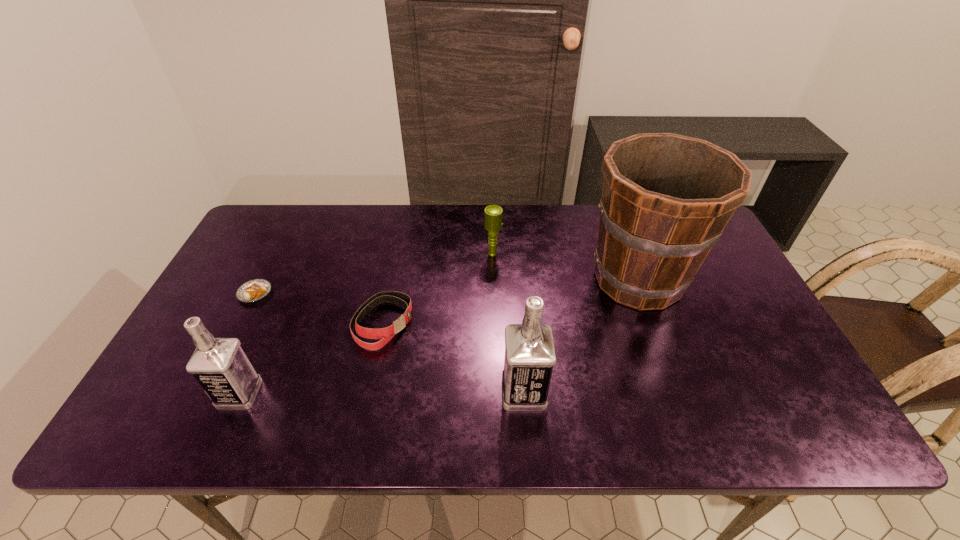
At what (x,y) coordinates should I click in order to perform the action: click on free point located on the front label of the shorter vodka. Please return your answer as a coordinate pair (x, y). This screenshot has height=540, width=960. Looking at the image, I should click on (169, 394).

At what (x,y) coordinates should I click in order to perform the action: click on vacant space located 0.180m on the front label of the fifth shortest object. Please return your answer as a coordinate pair (x, y). The image size is (960, 540). Looking at the image, I should click on tap(624, 392).

Identify the location of free spot located on the front of the microphone. The width and height of the screenshot is (960, 540). (496, 348).

Find the location of a particular element. This screenshot has width=960, height=540. vacant space located 0.120m on the left of the second shortest object is located at coordinates (308, 323).

The width and height of the screenshot is (960, 540). I want to click on vacant region located 0.240m on the right of the pastry, so click(x=358, y=293).

Find the location of `vacant space located on the front of the bucket`. vacant space located on the front of the bucket is located at coordinates (660, 337).

In order to click on microphone present at the far edge in this screenshot , I will do `click(493, 214)`.

Identify the location of bucket that is positioned at the far edge. (666, 198).

Identify the location of vodka present at the left edge. The image size is (960, 540). (220, 366).

Find the location of a particular element. pastry situated at the left edge is located at coordinates (254, 290).